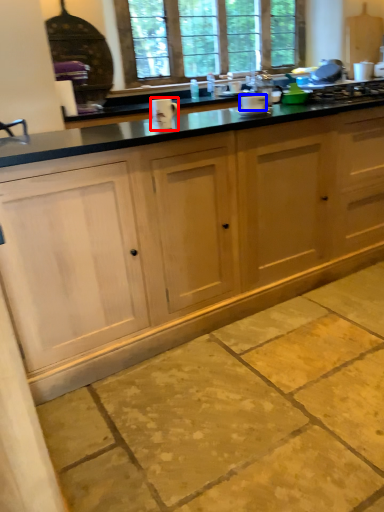
Question: Which object appears farthest to the camera in this image, appliance (highlighted by a red box) or appliance (highlighted by a blue box)?

Choices:
 (A) appliance
 (B) appliance

Answer: (B)